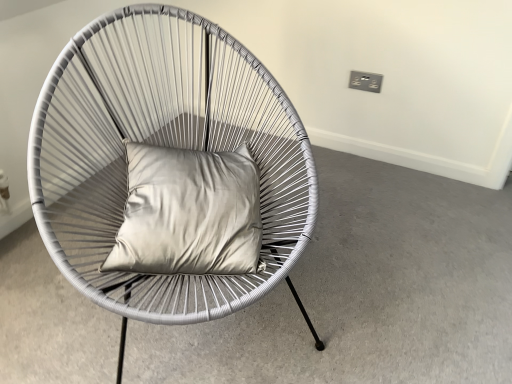
Question: From the image's perspective, is satin silver pillow at center under white woven chair at center?

Choices:
 (A) yes
 (B) no

Answer: (A)

Question: Is satin silver pillow at center closer to camera compared to white woven chair at center?

Choices:
 (A) no
 (B) yes

Answer: (A)

Question: Is satin silver pillow at center not within white woven chair at center?

Choices:
 (A) no
 (B) yes

Answer: (A)

Question: Can you confirm if satin silver pillow at center is wider than white woven chair at center?

Choices:
 (A) no
 (B) yes

Answer: (A)

Question: Is satin silver pillow at center aimed at white woven chair at center?

Choices:
 (A) yes
 (B) no

Answer: (A)

Question: Is satin silver pillow at center to the right of white woven chair at center from the viewer's perspective?

Choices:
 (A) no
 (B) yes

Answer: (B)

Question: Is white woven chair at center turned away from satin silver pillow at center?

Choices:
 (A) yes
 (B) no

Answer: (A)

Question: Is white woven chair at center at the right side of satin silver pillow at center?

Choices:
 (A) no
 (B) yes

Answer: (A)

Question: From the image's perspective, is white woven chair at center on satin silver pillow at center?

Choices:
 (A) yes
 (B) no

Answer: (A)

Question: Is white woven chair at center touching satin silver pillow at center?

Choices:
 (A) no
 (B) yes

Answer: (A)

Question: Does white woven chair at center have a greater width compared to satin silver pillow at center?

Choices:
 (A) no
 (B) yes

Answer: (B)

Question: Does white woven chair at center appear on the left side of satin silver pillow at center?

Choices:
 (A) yes
 (B) no

Answer: (A)

Question: Can white woven chair at center be found inside matte white chair at center?

Choices:
 (A) yes
 (B) no

Answer: (B)